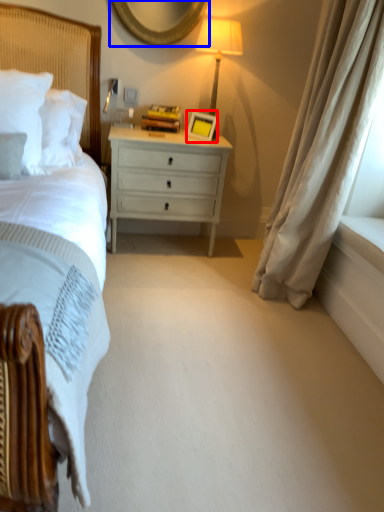
Question: Among these objects, which one is nearest to the camera, picture frame (highlighted by a red box) or mirror (highlighted by a blue box)?

Choices:
 (A) picture frame
 (B) mirror

Answer: (B)